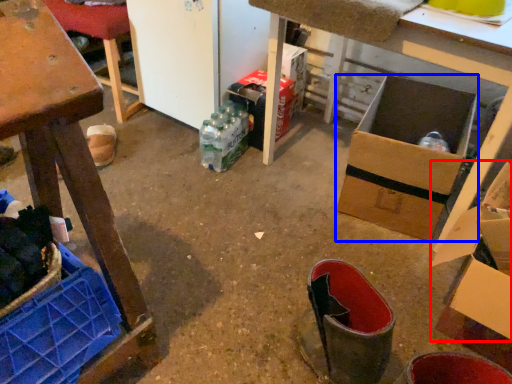
Question: Which of the following is the farthest to the observer, cardboard box (highlighted by a red box) or box (highlighted by a blue box)?

Choices:
 (A) cardboard box
 (B) box

Answer: (B)